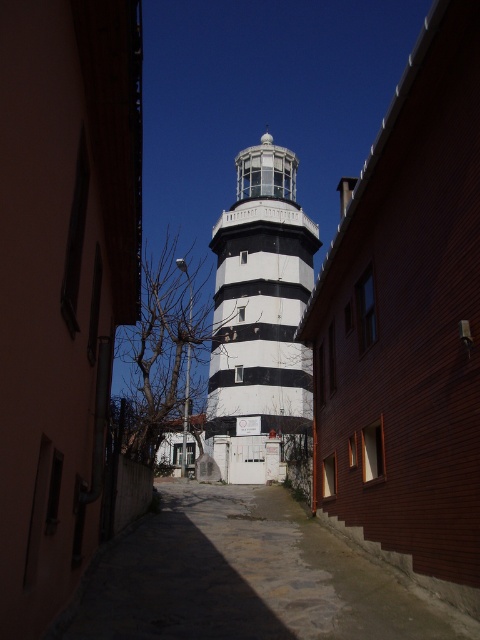
Question: Which point appears farthest from the camera in this image?

Choices:
 (A) (250, 292)
 (B) (275, 580)

Answer: (A)

Question: Which point is closer to the camera?

Choices:
 (A) (242, 388)
 (B) (130, 600)

Answer: (B)

Question: Can you confirm if smooth stone alley at center is positioned to the left of white painted concrete water tower at center?

Choices:
 (A) no
 (B) yes

Answer: (B)

Question: Can you confirm if smooth stone alley at center is positioned to the right of white painted concrete water tower at center?

Choices:
 (A) yes
 (B) no

Answer: (B)

Question: Can you confirm if smooth stone alley at center is bigger than white painted concrete water tower at center?

Choices:
 (A) yes
 (B) no

Answer: (B)